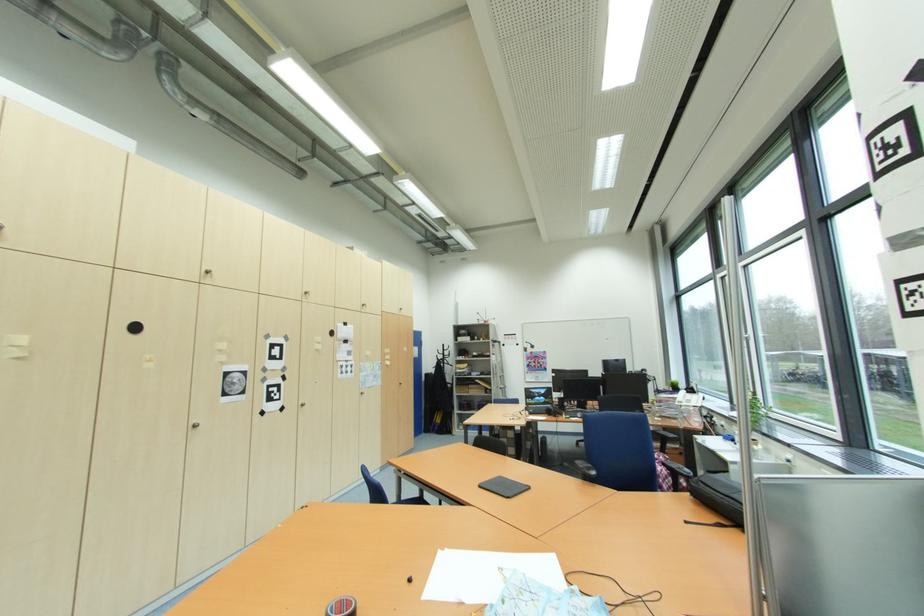
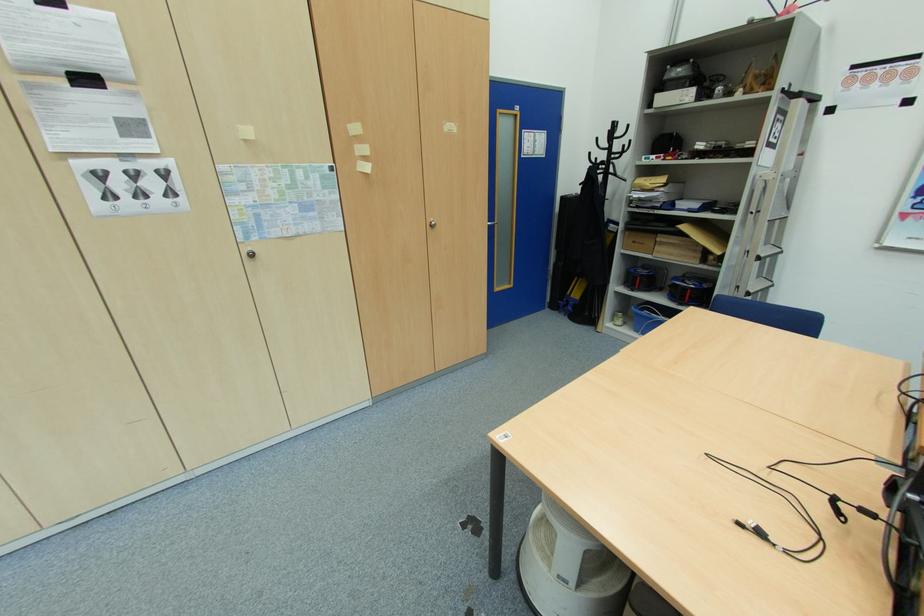
The point at (472, 386) is marked in the first image. Where is the corresponding point in the second image?

(660, 233)